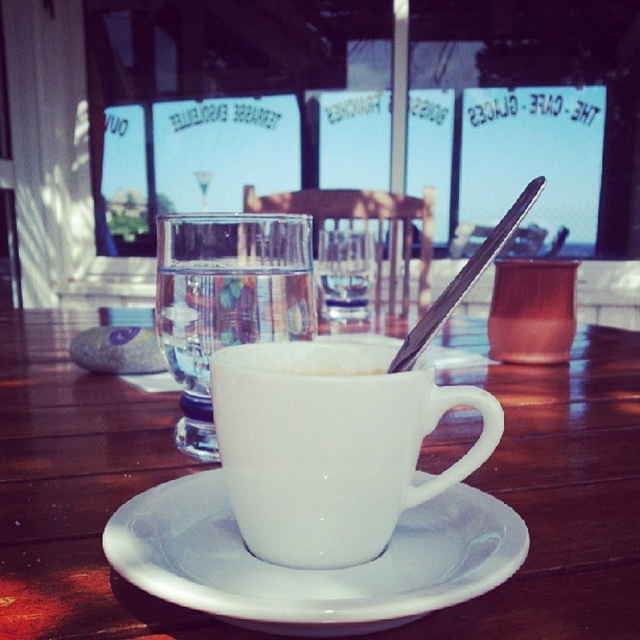
You are a barista who needs to place a new menu card between the white glossy saucer at center and the clear glass water at center. The menu card is 12 centimeters wide. Can it fit in the space between them?

The distance between the white glossy saucer at center and the clear glass water at center is 10.95 centimeters. Since the menu card is 12 centimeters wide, it cannot fit in the space between them as the available space is narrower than the card.

In the cozy cafe scene, there is a white ceramic coffee cup on a wooden table with a spoon inside and a glass of water nearby. The point marked at coordinates (310, 570) is part of which object? Please choose from the options below. A. The coffee cup with spoon. B. The saucer. C. The glass of water. D. The window text.

The point at coordinates (310, 570) corresponds to the white glossy saucer at center, so the correct answer is B. The saucer.